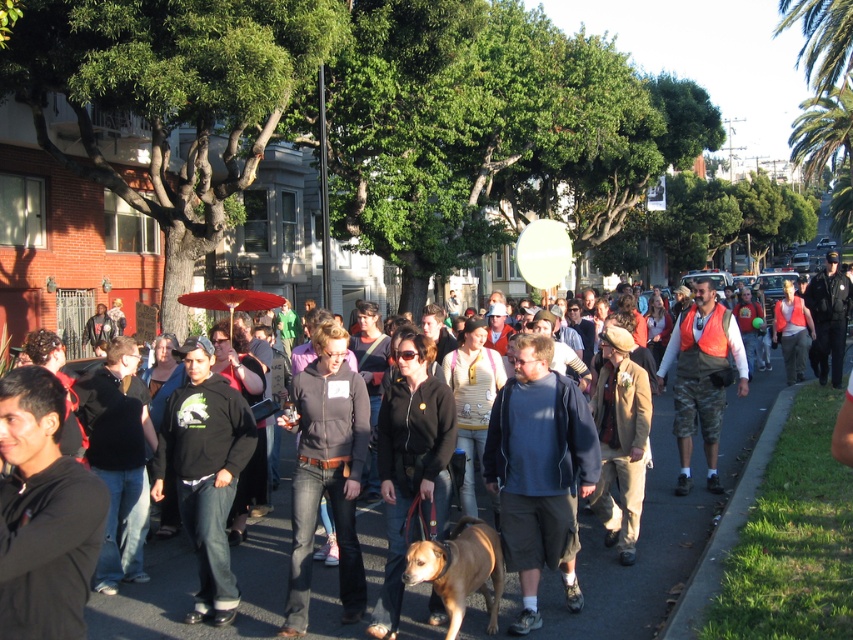
Between blue fleece jacket at center and camouflage shorts at center, which one is positioned lower?

blue fleece jacket at center is lower down.

Between point (523, 364) and point (700, 360), which one is positioned behind?

Positioned behind is point (700, 360).

Between point (546, 484) and point (743, 348), which one is positioned in front?

Point (546, 484) is more forward.

You are a GUI agent. You are given a task and a screenshot of the screen. Output one action in this format:
    pyautogui.click(x=<x>, y=<y>)
    Task: Click on the blue fleece jacket at center
    This screenshot has height=640, width=853.
    Given the screenshot: What is the action you would take?
    pyautogui.click(x=538, y=472)

Between point (527, 621) and point (428, 552), which one is positioned behind?

The point (527, 621) is more distant.

Which of these two, blue fleece jacket at center or brown furry dog at center, stands taller?

With more height is blue fleece jacket at center.

Who is more forward, [544,385] or [447,634]?

Positioned in front is point [447,634].

This screenshot has width=853, height=640. What are the coordinates of `blue fleece jacket at center` in the screenshot? It's located at (538, 472).

Can you confirm if smooth asphalt pavement at center is bigger than brown furry dog at center?

Indeed, smooth asphalt pavement at center has a larger size compared to brown furry dog at center.

Which of these two, smooth asphalt pavement at center or brown furry dog at center, stands shorter?

smooth asphalt pavement at center is shorter.

Which is in front, point (728, 419) or point (416, 548)?

Positioned in front is point (416, 548).

The height and width of the screenshot is (640, 853). I want to click on smooth asphalt pavement at center, so click(x=659, y=528).